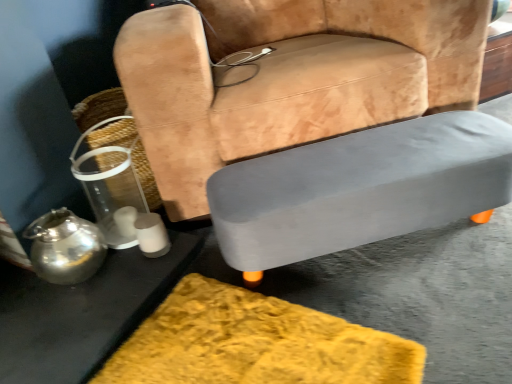
You are a GUI agent. You are given a task and a screenshot of the screen. Output one action in this format:
    pyautogui.click(x=<x>, y=<y>)
    Task: Click on the free space above metallic silver table at lower left, the second table in the right-to-left sequence (from a real-world perspective)
    
    Given the screenshot: What is the action you would take?
    pyautogui.click(x=68, y=298)